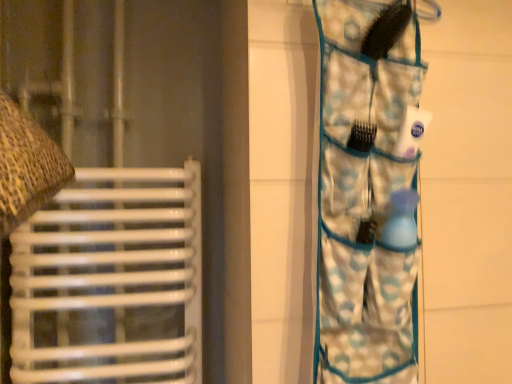
Question: Is blue patterned fabric at right positioned with its back to matte brown fabric at left?

Choices:
 (A) yes
 (B) no

Answer: (B)

Question: Is blue patterned fabric at right touching matte brown fabric at left?

Choices:
 (A) no
 (B) yes

Answer: (A)

Question: Does blue patterned fabric at right appear on the left side of matte brown fabric at left?

Choices:
 (A) yes
 (B) no

Answer: (B)

Question: Is the position of blue patterned fabric at right more distant than that of matte brown fabric at left?

Choices:
 (A) yes
 (B) no

Answer: (B)

Question: Would you say blue patterned fabric at right is a long distance from matte brown fabric at left?

Choices:
 (A) yes
 (B) no

Answer: (B)

Question: Can you confirm if blue patterned fabric at right is shorter than matte brown fabric at left?

Choices:
 (A) no
 (B) yes

Answer: (B)

Question: Is matte brown fabric at left far from blue patterned fabric at right?

Choices:
 (A) no
 (B) yes

Answer: (A)

Question: Is matte brown fabric at left outside of blue patterned fabric at right?

Choices:
 (A) no
 (B) yes

Answer: (B)

Question: Considering the relative positions of matte brown fabric at left and blue patterned fabric at right in the image provided, is matte brown fabric at left to the left of blue patterned fabric at right from the viewer's perspective?

Choices:
 (A) yes
 (B) no

Answer: (A)

Question: Considering the relative sizes of matte brown fabric at left and blue patterned fabric at right in the image provided, is matte brown fabric at left wider than blue patterned fabric at right?

Choices:
 (A) no
 (B) yes

Answer: (B)

Question: Considering the relative sizes of matte brown fabric at left and blue patterned fabric at right in the image provided, is matte brown fabric at left taller than blue patterned fabric at right?

Choices:
 (A) yes
 (B) no

Answer: (A)

Question: Does matte brown fabric at left have a smaller size compared to blue patterned fabric at right?

Choices:
 (A) yes
 (B) no

Answer: (B)

Question: From their relative heights in the image, would you say matte brown fabric at left is taller or shorter than blue patterned fabric at right?

Choices:
 (A) tall
 (B) short

Answer: (A)